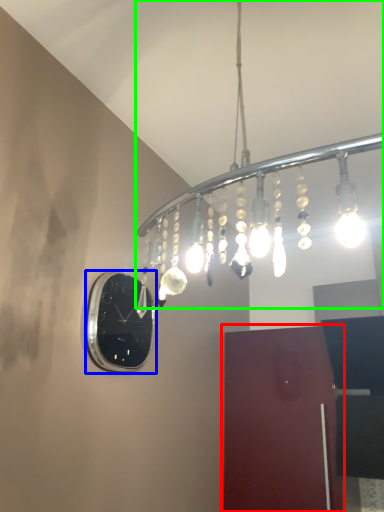
Question: Which object is positioned farthest from door (highlighted by a red box)? Select from clock (highlighted by a blue box) and lamp (highlighted by a green box).

Choices:
 (A) clock
 (B) lamp

Answer: (A)